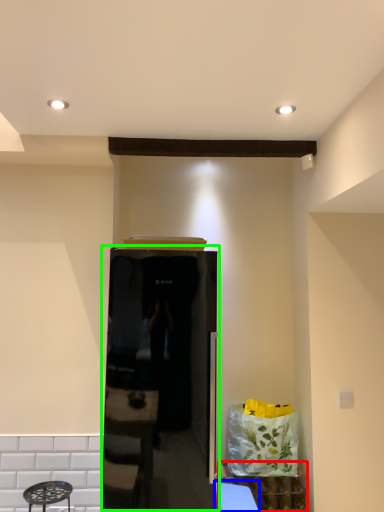
Question: Based on their relative distances, which object is nearer to cabinetry (highlighted by a red box)? Choose from table (highlighted by a blue box) and appliance (highlighted by a green box).

Choices:
 (A) table
 (B) appliance

Answer: (A)